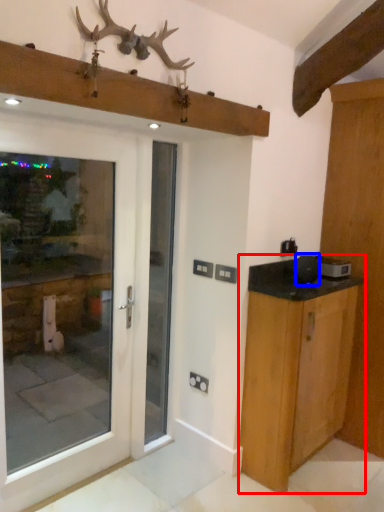
Question: Which object is closer to the camera taking this photo, cabinetry (highlighted by a red box) or appliance (highlighted by a blue box)?

Choices:
 (A) cabinetry
 (B) appliance

Answer: (A)